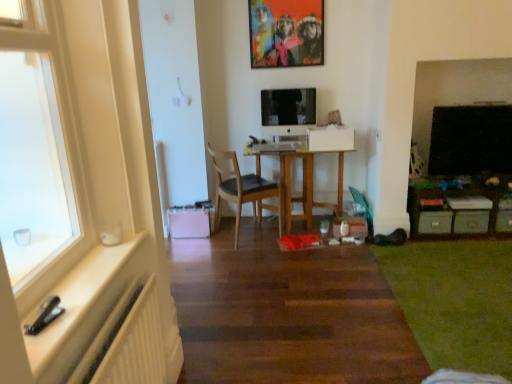
The image size is (512, 384). What do you see at coordinates (86, 306) in the screenshot?
I see `black plastic stapler at left` at bounding box center [86, 306].

This screenshot has height=384, width=512. What do you see at coordinates (127, 343) in the screenshot?
I see `white ribbed radiator at lower left` at bounding box center [127, 343].

Describe the element at coordinates (286, 33) in the screenshot. Image resolution: width=512 pixels, height=384 pixels. I see `acrylic painting at upper center` at that location.

The image size is (512, 384). I want to click on wooden desk at center, so click(x=303, y=178).

Is acrylic painting at upper center outside of black glossy tv at right?

Yes.

Can you confirm if acrylic painting at upper center is taller than black glossy tv at right?

No.

How distant is acrylic painting at upper center from black glossy tv at right?

acrylic painting at upper center is 1.42 meters away from black glossy tv at right.

At what (x,y) coordinates should I click in order to perform the action: click on picture frame above the black glossy tv at right (from the image's perspective). Please return your answer as a coordinate pair (x, y). Looking at the image, I should click on (286, 33).

Is white glossy window sill at left positioned behind green matte drawer at lower right, which is the 1th drawer in right-to-left order?

No, white glossy window sill at left is closer to the viewer.

In terms of size, does white glossy window sill at left appear bigger or smaller than green matte drawer at lower right, which is the 1th drawer in right-to-left order?

white glossy window sill at left is bigger than green matte drawer at lower right, which is the 1th drawer in right-to-left order.

Can you confirm if white glossy window sill at left is positioned to the right of green matte drawer at lower right, which is the 1th drawer in right-to-left order?

Incorrect, white glossy window sill at left is not on the right side of green matte drawer at lower right, which is the 1th drawer in right-to-left order.

Consider the image. Is white glossy window sill at left not near green matte drawer at lower right, which is the 1th drawer in right-to-left order?

Yes.

Is point (313, 89) less distant than point (296, 200)?

Yes, it is.

Is satin black monitor at center completely or partially outside of wooden desk at center?

satin black monitor at center lies outside wooden desk at center's area.

Considering the relative sizes of satin black monitor at center and wooden desk at center in the image provided, is satin black monitor at center smaller than wooden desk at center?

Yes.

Consider the image. Is satin black monitor at center facing away from wooden desk at center?

No, satin black monitor at center's orientation is not away from wooden desk at center.

Considering the points (256, 178) and (277, 0), which point is in front, point (256, 178) or point (277, 0)?

Point (277, 0)

Is there a large distance between wooden chair at center and acrylic painting at upper center?

Yes, wooden chair at center and acrylic painting at upper center are quite far apart.

Based on their sizes in the image, would you say wooden chair at center is bigger or smaller than acrylic painting at upper center?

Considering their sizes, wooden chair at center takes up more space than acrylic painting at upper center.

Is metallic green storage at right beside white glossy window sill at left?

metallic green storage at right is not next to white glossy window sill at left, and they're not touching.

Relative to white glossy window sill at left, is metallic green storage at right in front or behind?

Visually, metallic green storage at right is located behind white glossy window sill at left.

Can you tell me how much metallic green storage at right and white glossy window sill at left differ in facing direction?

The angular difference between metallic green storage at right and white glossy window sill at left is 90 degrees.

Identify the location of desk below the satin black monitor at center (from a real-world perspective). This screenshot has height=384, width=512. (303, 178).

Visually, is wooden desk at center positioned to the left or to the right of satin black monitor at center?

wooden desk at center is to the right of satin black monitor at center.

Considering the sizes of objects wooden desk at center and satin black monitor at center in the image provided, who is bigger, wooden desk at center or satin black monitor at center?

Bigger between the two is wooden desk at center.

From a real-world perspective, is white glossy window sill at left located beneath acrylic painting at upper center?

Yes, from a real-world perspective, white glossy window sill at left is under acrylic painting at upper center.

Is acrylic painting at upper center inside white glossy window sill at left?

No.

Could you tell me if white glossy window sill at left is facing acrylic painting at upper center?

No, white glossy window sill at left is not oriented towards acrylic painting at upper center.

The height and width of the screenshot is (384, 512). I want to click on desktop on the right of acrylic painting at upper center, so click(470, 140).

In order to click on window on the left of the green matte drawer at lower right, which is the 1th drawer in right-to-left order in this screenshot , I will do `click(38, 147)`.

Considering their positions, is green carpet at lower right positioned closer to acrylic painting at upper center than black glossy tv at right?

black glossy tv at right is closer to acrylic painting at upper center.

Based on their spatial positions, is wooden desk at center or satin black monitor at center closer to acrylic painting at upper center?

satin black monitor at center is closer to acrylic painting at upper center.

From the image, which object appears to be farther from green carpet at lower right, green matte drawer at lower right, the first drawer from the left, or white ribbed radiator at lower left?

white ribbed radiator at lower left is further to green carpet at lower right.

Considering their positions, is satin black monitor at center positioned closer to white glossy window sill at left than green matte drawer at lower right, placed as the second drawer when sorted from left to right?

The object closer to white glossy window sill at left is satin black monitor at center.

Which object lies further to the anchor point wooden chair at center, metallic green storage at right or acrylic painting at upper center?

metallic green storage at right lies further to wooden chair at center than the other object.

Which object lies nearer to the anchor point wooden desk at center, white ribbed radiator at lower left or metallic green storage at right?

metallic green storage at right is closer to wooden desk at center.

From the image, which object appears to be nearer to black glossy tv at right, green matte drawer at lower right, placed as the second drawer when sorted from right to left, or green carpet at lower right?

Among the two, green matte drawer at lower right, placed as the second drawer when sorted from right to left, is located nearer to black glossy tv at right.

From the image, which object appears to be nearer to green matte drawer at lower right, placed as the second drawer when sorted from left to right, black plastic stapler at left or green carpet at lower right?

green carpet at lower right is positioned closer to the anchor green matte drawer at lower right, placed as the second drawer when sorted from left to right.

At what (x,y) coordinates should I click in order to perform the action: click on plain positioned between white ribbed radiator at lower left and green matte drawer at lower right, placed as the second drawer when sorted from right to left, from near to far. Please return your answer as a coordinate pair (x, y). The height and width of the screenshot is (384, 512). Looking at the image, I should click on (455, 300).

Locate an element on the screen. This screenshot has width=512, height=384. chair between white glossy window sill at left and acrylic painting at upper center in the front-back direction is located at coordinates (241, 190).

Locate an element on the screen. chair between white glossy window sill at left and metallic green storage at right along the z-axis is located at coordinates (241, 190).

The height and width of the screenshot is (384, 512). Find the location of `window sill between white glossy window sill at left and black glossy tv at right in the front-back direction`. window sill between white glossy window sill at left and black glossy tv at right in the front-back direction is located at coordinates (86, 306).